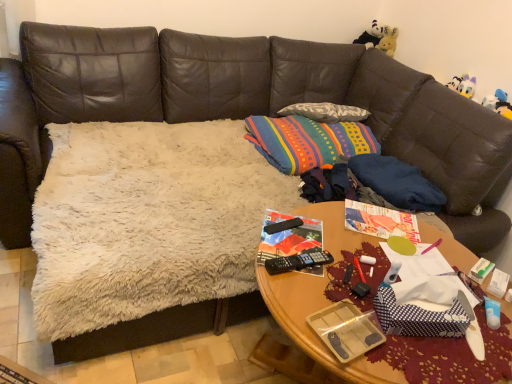
Question: In terms of width, does woodenobject at center look wider or thinner when compared to black plastic remote control at center?

Choices:
 (A) thin
 (B) wide

Answer: (B)

Question: In terms of size, does woodenobject at center appear bigger or smaller than black plastic remote control at center?

Choices:
 (A) big
 (B) small

Answer: (A)

Question: Which is nearer to the plush white bear at upper right, which is the second toy in right-to-left order?

Choices:
 (A) clear plastic tray at center
 (B) blue dotted paper at center
 (C) black plastic remote control at center
 (D) woodenobject at center
 (E) white plush duck at upper right, which appears as the 1th toy when viewed from the right

Answer: (E)

Question: Based on their relative distances, which object is nearer to the clear plastic tray at center?

Choices:
 (A) white plush duck at upper right, which appears as the 1th toy when viewed from the right
 (B) woodenobject at center
 (C) plush white bear at upper right, the 1th toy when ordered from top to bottom
 (D) blue dotted paper at center
 (E) black plastic remote control at center

Answer: (D)